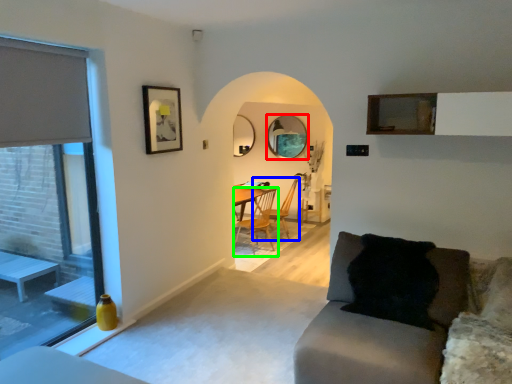
Question: Estimate the real-world distances between objects in this image. Which object is closer to mirror (highlighted by a red box), chair (highlighted by a blue box) or chair (highlighted by a green box)?

Choices:
 (A) chair
 (B) chair

Answer: (A)